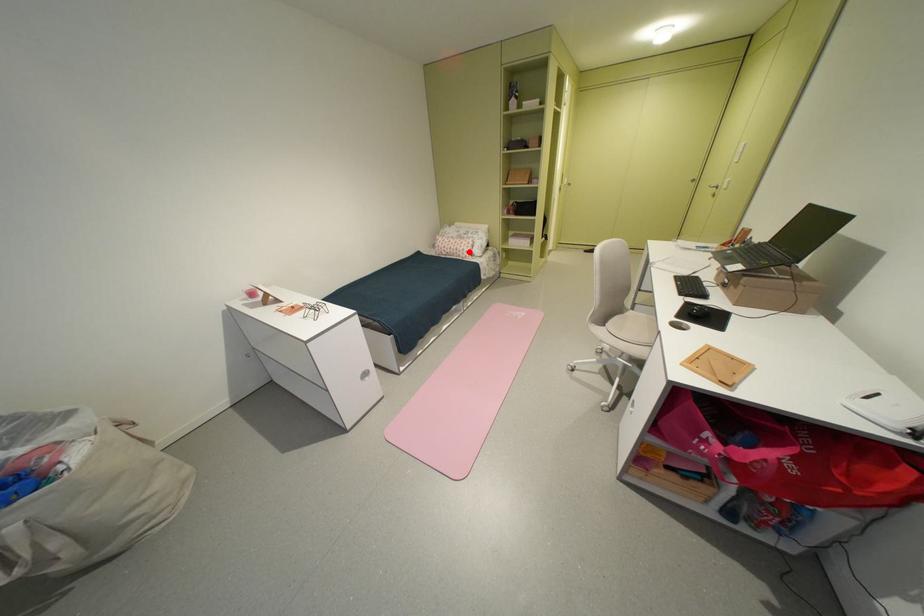
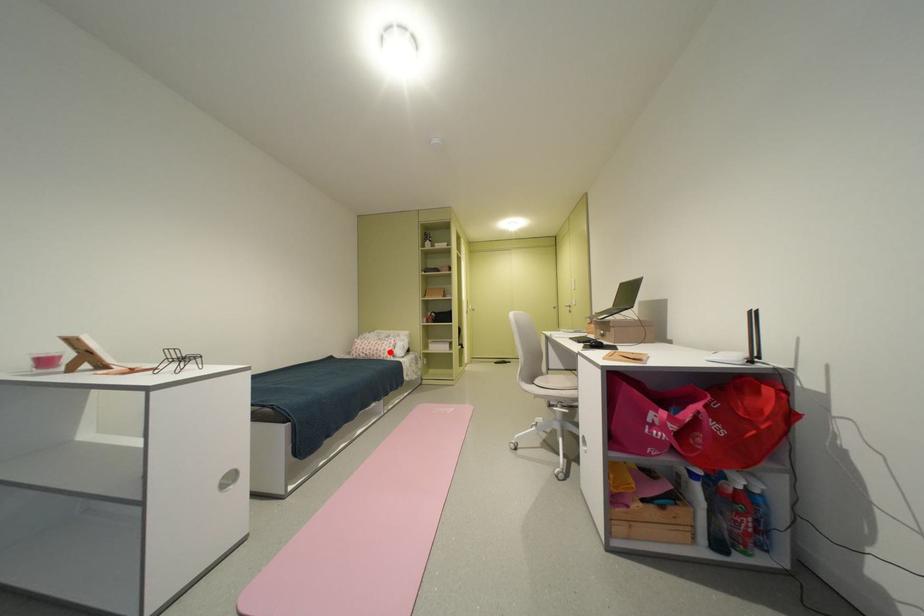
In the scene shown: I am providing you with two images of the same scene from different viewpoints. A red point is marked on the first image and another point is marked on the second image. Is the marked point in image1 the same physical position as the marked point in image2?

Yes